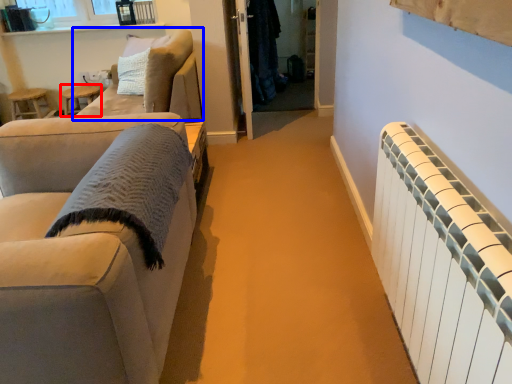
Question: Which of the following is the farthest to the observer, side table (highlighted by a red box) or studio couch (highlighted by a blue box)?

Choices:
 (A) side table
 (B) studio couch

Answer: (A)